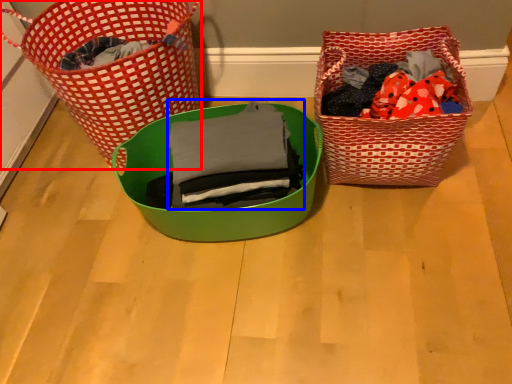
Question: Which object appears closest to the camera in this image, picnic basket (highlighted by a red box) or clothing (highlighted by a blue box)?

Choices:
 (A) picnic basket
 (B) clothing

Answer: (B)